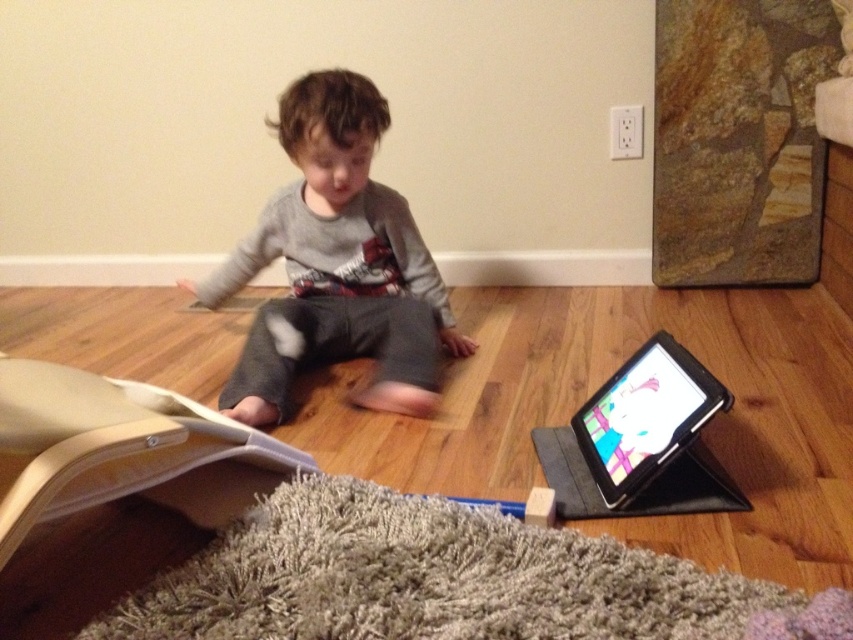
Question: Can you confirm if gray cotton shirt at center is thinner than black plastic tablet at lower right?

Choices:
 (A) no
 (B) yes

Answer: (A)

Question: Is gray cotton shirt at center closer to the viewer compared to black plastic tablet at lower right?

Choices:
 (A) no
 (B) yes

Answer: (A)

Question: Which of the following is the farthest from the observer?

Choices:
 (A) gray cotton shirt at center
 (B) black plastic tablet at lower right

Answer: (A)

Question: Which point is farther to the camera?

Choices:
 (A) (305, 236)
 (B) (596, 426)

Answer: (A)

Question: Where is gray cotton shirt at center located in relation to black plastic tablet at lower right in the image?

Choices:
 (A) left
 (B) right

Answer: (A)

Question: Which object appears closest to the camera in this image?

Choices:
 (A) black plastic tablet at lower right
 (B) gray cotton shirt at center

Answer: (A)